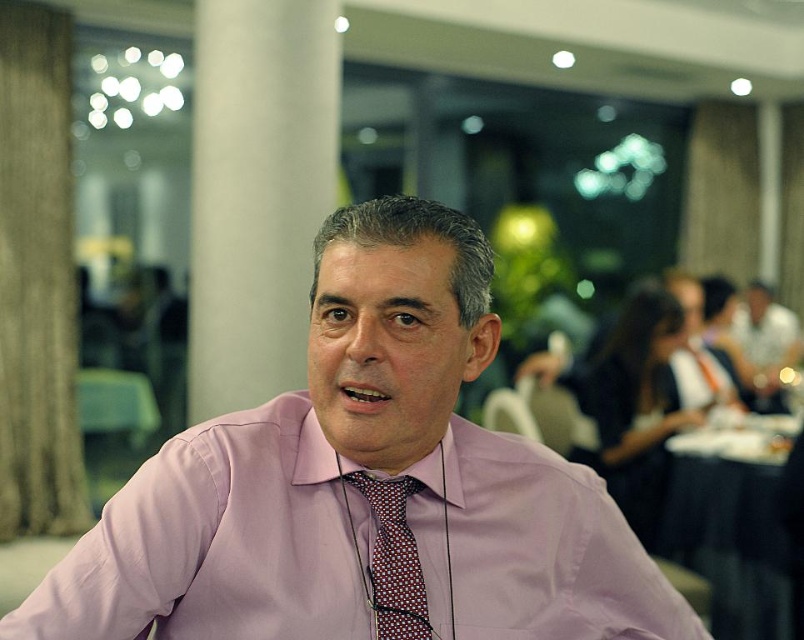
Question: Which point is closer to the camera?

Choices:
 (A) red dotted tie at center
 (B) pink fabric shirt at center
 (C) black fabric table at lower right

Answer: (B)

Question: Which point is closer to the camera?

Choices:
 (A) (753, 509)
 (B) (388, 561)
 (C) (448, 220)

Answer: (C)

Question: Is pink fabric shirt at center to the left of black fabric table at lower right from the viewer's perspective?

Choices:
 (A) yes
 (B) no

Answer: (A)

Question: Is the position of pink fabric shirt at center more distant than that of black fabric table at lower right?

Choices:
 (A) no
 (B) yes

Answer: (A)

Question: Is pink fabric shirt at center positioned before black fabric table at lower right?

Choices:
 (A) yes
 (B) no

Answer: (A)

Question: Based on their relative distances, which object is farther from the red dotted tie at center?

Choices:
 (A) black fabric table at lower right
 (B) pink fabric shirt at center

Answer: (A)